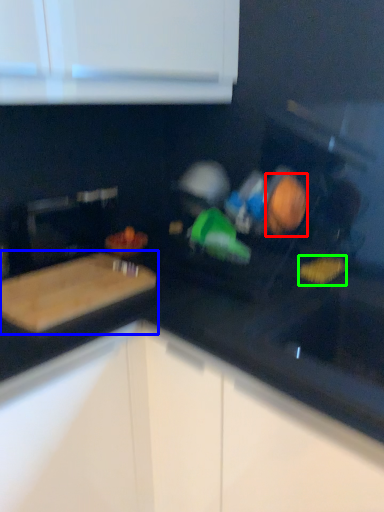
Question: Which is nearer to the food (highlighted by a red box)? cutting board (highlighted by a blue box) or food (highlighted by a green box).

Choices:
 (A) cutting board
 (B) food

Answer: (B)